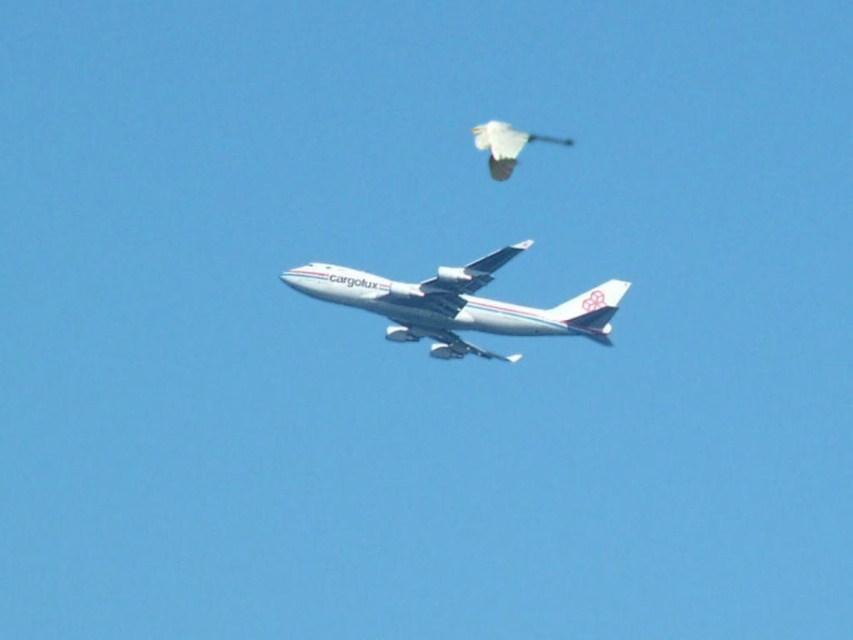
Question: Among these points, which one is nearest to the camera?

Choices:
 (A) (496, 131)
 (B) (451, 305)

Answer: (A)

Question: Where is white glossy airplane at center located in relation to white matte bird at upper center in the image?

Choices:
 (A) left
 (B) right

Answer: (A)

Question: Is white glossy airplane at center bigger than white matte bird at upper center?

Choices:
 (A) no
 (B) yes

Answer: (B)

Question: Is white glossy airplane at center smaller than white matte bird at upper center?

Choices:
 (A) no
 (B) yes

Answer: (A)